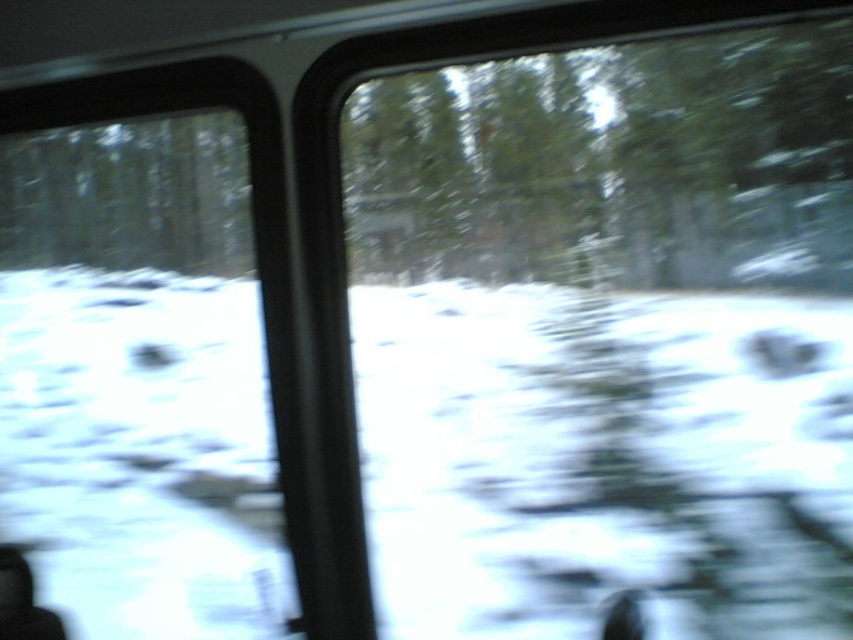
Question: Is green matte tree at upper center bigger than green matte tree at upper left?

Choices:
 (A) yes
 (B) no

Answer: (A)

Question: Which point appears closest to the camera in this image?

Choices:
 (A) (62, 218)
 (B) (424, 204)

Answer: (B)

Question: Does green matte tree at upper center appear on the right side of green matte tree at upper left?

Choices:
 (A) no
 (B) yes

Answer: (B)

Question: Among these objects, which one is nearest to the camera?

Choices:
 (A) green matte tree at upper center
 (B) green matte tree at upper left

Answer: (A)

Question: Among these points, which one is farthest from the camera?

Choices:
 (A) (824, 269)
 (B) (132, 260)

Answer: (B)

Question: Can you confirm if green matte tree at upper center is positioned below green matte tree at upper left?

Choices:
 (A) yes
 (B) no

Answer: (B)